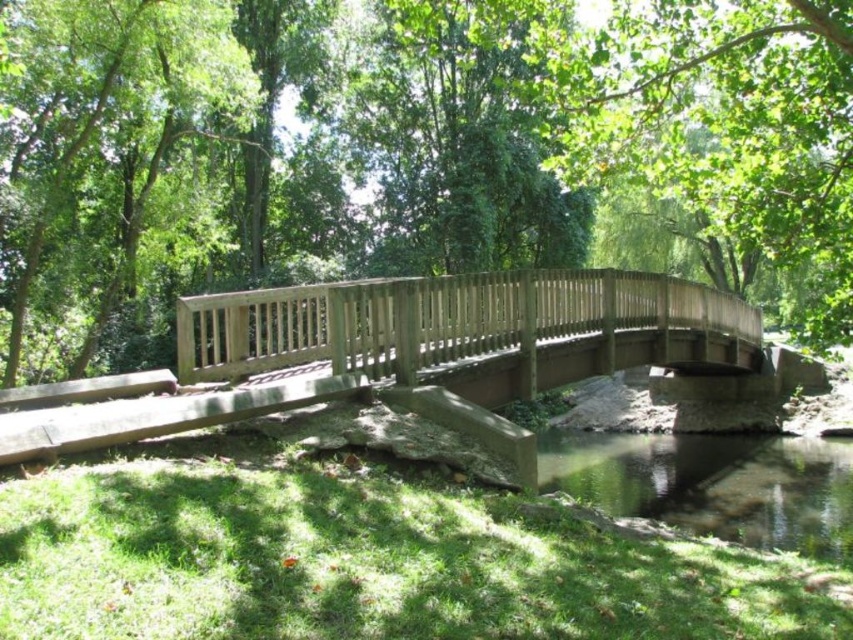
You are a hiker standing on the wooden bridge at center and want to take a photo of the green leafy tree at center. Which direction should you face to ensure the tree is fully visible without obstruction?

The wooden bridge at center is behind the green leafy tree at center, so you should face away from the tree to ensure it is fully visible without obstruction.

You are standing on the green matte bridge at center and want to look down at the green leafy tree at center. Is the tree visible from your current position on the bridge?

The green matte bridge at center is located above the green leafy tree at center, so the tree is directly underneath the bridge. Since the bridge has a flat deck and railing made of vertical wooden slats, you might have a clear view of the tree if the deck isn not obstructing your downward view. However, the railing could block the view depending on its height and spacing. The description doesn not specify the railing height, so it is possible the tree is visible through gaps in the railing or by moving to

From the picture: You are planning to take a photo of the green leafy tree at center and the clear water at lower center. Which object should you focus on first if you want to capture both in a single frame without moving the camera?

The green leafy tree at center is bigger than clear water at lower center, so you should focus on the green leafy tree at center first to ensure it fills the frame appropriately before adjusting for the smaller clear water at lower center.